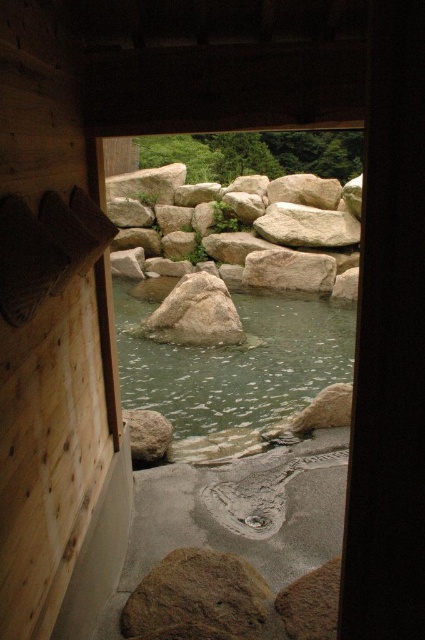
Does brown rough rock at lower center appear under smooth gray rock at center?

Correct, brown rough rock at lower center is located below smooth gray rock at center.

How distant is brown rough rock at lower center from smooth gray rock at center?

They are 5.28 meters apart.

Is point (221, 556) positioned behind point (210, 308)?

No, it is not.

This screenshot has height=640, width=425. I want to click on brown rough rock at lower center, so click(198, 598).

Which is behind, point (246, 374) or point (139, 436)?

Point (246, 374)

Who is lower down, green stone river at center or smooth gray rock at lower left?

smooth gray rock at lower left

Where is `green stone river at center`? green stone river at center is located at coordinates (234, 360).

Is point (127, 621) farther from camera compared to point (158, 428)?

No, it is in front of (158, 428).

This screenshot has width=425, height=640. What do you see at coordinates (198, 598) in the screenshot?
I see `brown rough rock at lower center` at bounding box center [198, 598].

Does point (187, 582) come farther from viewer compared to point (144, 419)?

That is False.

The image size is (425, 640). What are the coordinates of `brown rough rock at lower center` in the screenshot? It's located at (198, 598).